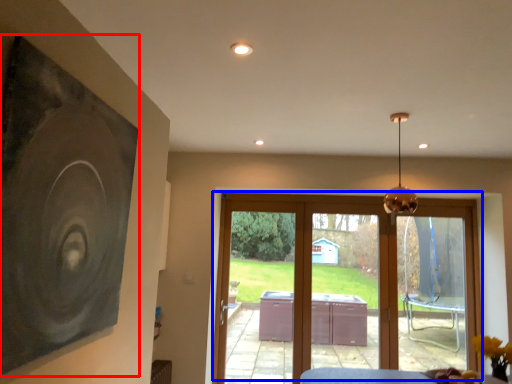
Question: Which point is closer to the camera, picture frame (highlighted by a red box) or door (highlighted by a blue box)?

Choices:
 (A) picture frame
 (B) door

Answer: (A)